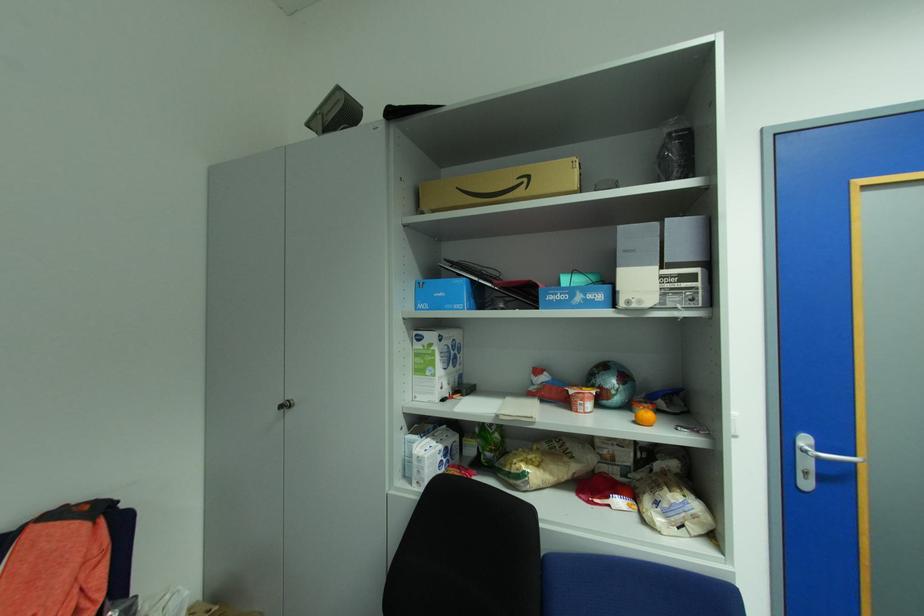
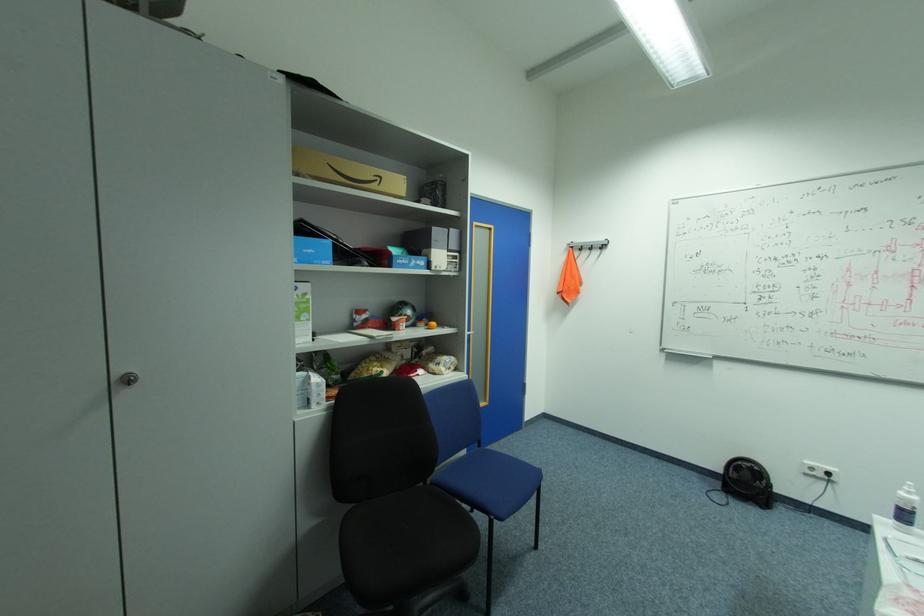
Find the pixel in the second image that matches the point at 293,406 in the first image.

(137, 379)